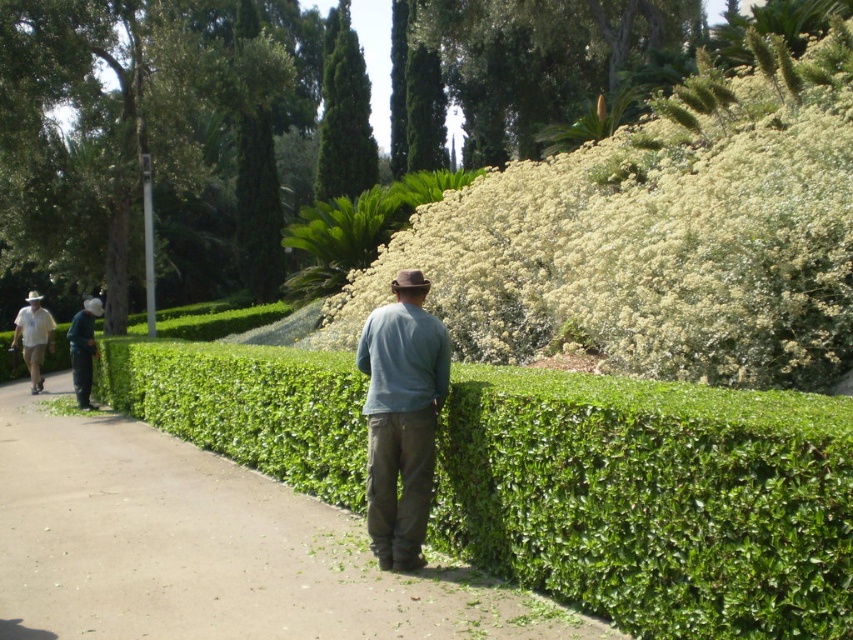
Question: Which point is closer to the camera?

Choices:
 (A) (840, 113)
 (B) (357, 124)

Answer: (A)

Question: Does teal cotton shirt at center have a greater width compared to green textured tree at upper center?

Choices:
 (A) yes
 (B) no

Answer: (B)

Question: From the image, what is the correct spatial relationship of green textured tree at upper center in relation to light blue shirt at left?

Choices:
 (A) above
 (B) below

Answer: (A)

Question: Which object is the closest to the dark blue jeans at left?

Choices:
 (A) green leafy hedge at center
 (B) green leafy tree at upper center
 (C) teal cotton shirt at center
 (D) white fluffy bush at upper center

Answer: (B)

Question: Does white fluffy bush at upper right have a greater width compared to teal cotton shirt at center?

Choices:
 (A) yes
 (B) no

Answer: (B)

Question: Which of the following is the farthest from the observer?

Choices:
 (A) green leafy hedge at center
 (B) white fluffy bush at upper center

Answer: (B)